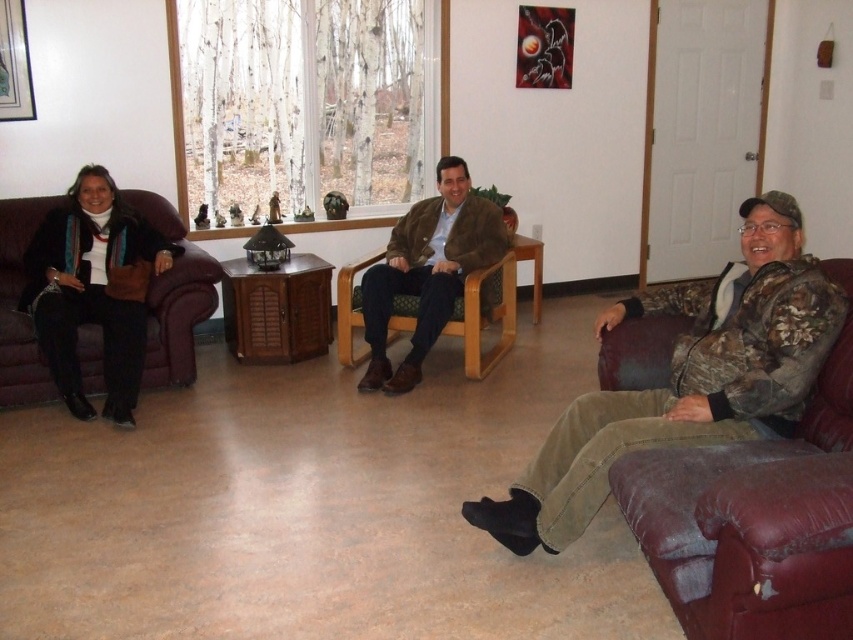
Is leather couch at right positioned at the back of leather couch at left?

No, leather couch at right is in front of leather couch at left.

What do you see at coordinates (746, 522) in the screenshot? I see `leather couch at right` at bounding box center [746, 522].

This screenshot has height=640, width=853. Describe the element at coordinates (746, 522) in the screenshot. I see `leather couch at right` at that location.

Where is `leather couch at right`? leather couch at right is located at coordinates (746, 522).

Is leather couch at left bigger than brushed metal picture frame at upper left?

Yes, leather couch at left is bigger than brushed metal picture frame at upper left.

From the picture: Who is taller, leather couch at left or brushed metal picture frame at upper left?

Standing taller between the two is leather couch at left.

Which is in front, point (177, 298) or point (21, 72)?

Point (177, 298) is in front.

Find the location of a particular element. leather couch at left is located at coordinates (173, 296).

Does leather couch at right have a greater width compared to brushed metal picture frame at upper left?

Yes, leather couch at right is wider than brushed metal picture frame at upper left.

From the picture: How far apart are leather couch at right and brushed metal picture frame at upper left?

leather couch at right is 3.98 meters from brushed metal picture frame at upper left.

Identify the location of leather couch at right. This screenshot has width=853, height=640. (746, 522).